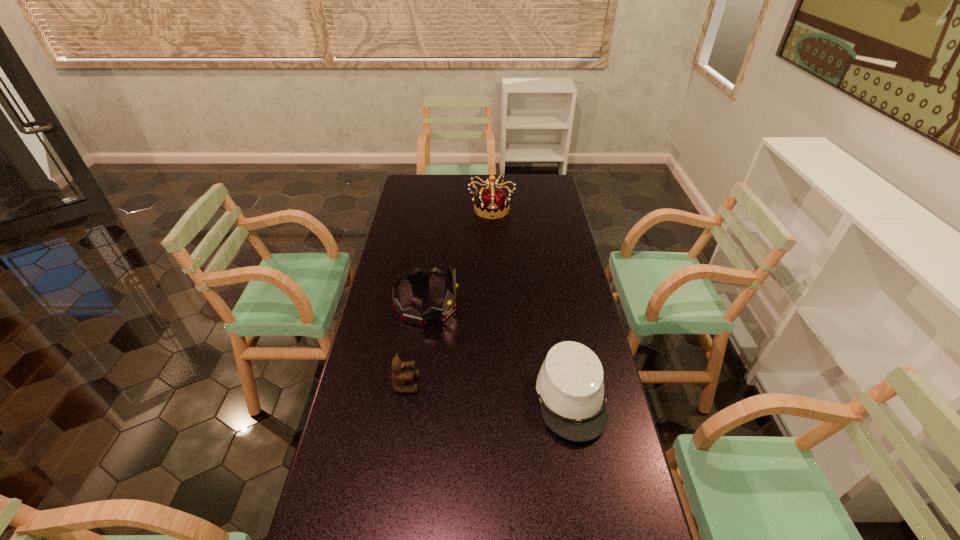
At what (x,y) coordinates should I click in order to perform the action: click on empty location between the second object from right to left and the rightmost object. Please return your answer as a coordinate pair (x, y). Looking at the image, I should click on (531, 303).

Find the location of `unoccupied area between the tallest object and the rightmost object`. unoccupied area between the tallest object and the rightmost object is located at coordinates (531, 303).

Where is `vacant space that is in between the teddy bear and the third nearest object`? The height and width of the screenshot is (540, 960). vacant space that is in between the teddy bear and the third nearest object is located at coordinates (417, 344).

Identify which object is the second closest to the farther tiara. Please provide its 2D coordinates. Your answer should be formatted as a tuple, i.e. [(x, y)], where the tuple contains the x and y coordinates of a point satisfying the conditions above.

[(570, 386)]

Where is `object that is the second closest to the right tiara`? Image resolution: width=960 pixels, height=540 pixels. object that is the second closest to the right tiara is located at coordinates (570, 386).

Where is `tiara that is the closest to the rightmost object`? The width and height of the screenshot is (960, 540). tiara that is the closest to the rightmost object is located at coordinates (419, 277).

What are the coordinates of `vacant position in the image that satisfies the following two spatial constraints: 1. on the front-facing side of the right tiara; 2. at the front of the third shortest object with jewels` in the screenshot? It's located at (494, 305).

In order to click on free location that satisfies the following two spatial constraints: 1. on the front-facing side of the tallest object; 2. at the front of the second tallest object with jewels in this screenshot , I will do `click(494, 305)`.

What are the coordinates of `vacant position in the image that satisfies the following two spatial constraints: 1. on the front-facing side of the second object from right to left; 2. at the front of the third nearest object with jewels` in the screenshot? It's located at (494, 305).